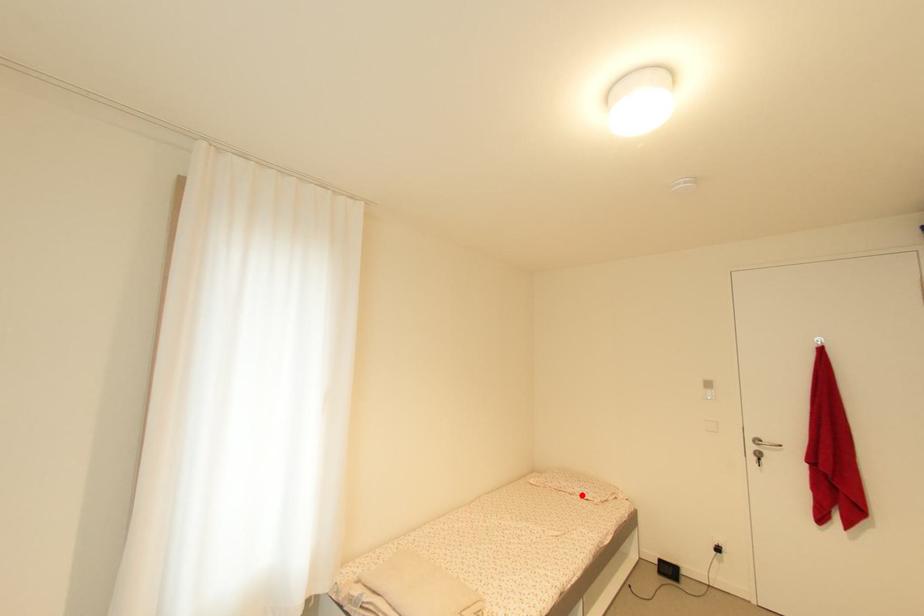
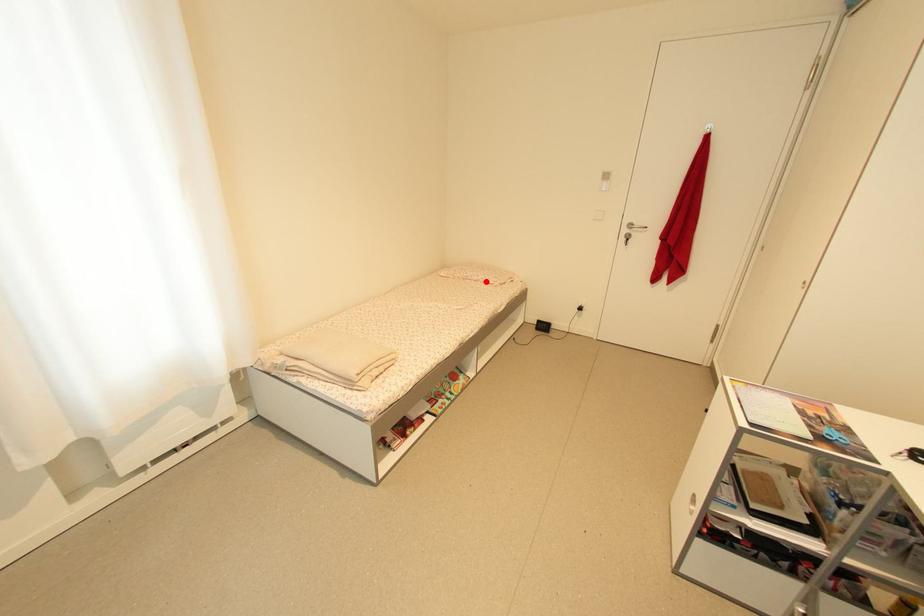
I am providing you with two images of the same scene from different viewpoints. A red point is marked on the first image and another point is marked on the second image. Is the marked point in image1 the same physical position as the marked point in image2?

Yes